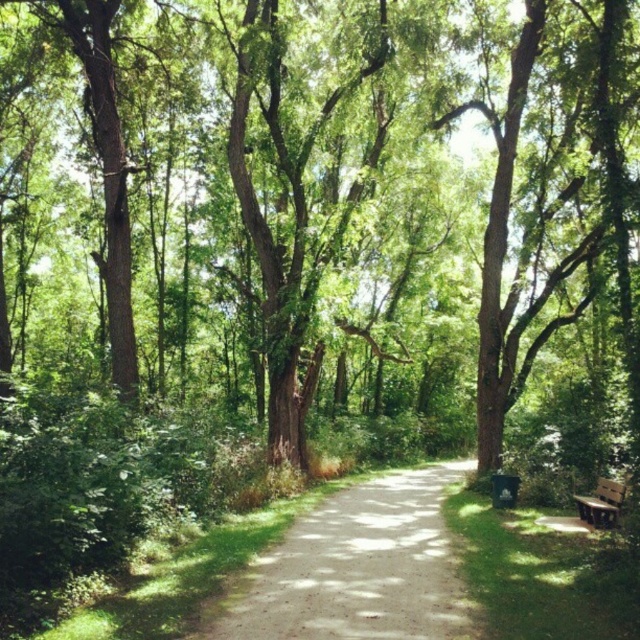
Question: Among these objects, which one is nearest to the camera?

Choices:
 (A) brown wooden bench at lower right
 (B) dirt/gravel path at center

Answer: (B)

Question: Is dirt/gravel path at center positioned in front of brown wooden bench at lower right?

Choices:
 (A) no
 (B) yes

Answer: (B)

Question: Does dirt/gravel path at center appear over brown wooden bench at lower right?

Choices:
 (A) no
 (B) yes

Answer: (A)

Question: Which point appears closest to the camera in this image?

Choices:
 (A) (266, 573)
 (B) (611, 497)

Answer: (A)

Question: Does dirt/gravel path at center have a lesser width compared to brown wooden bench at lower right?

Choices:
 (A) yes
 (B) no

Answer: (B)